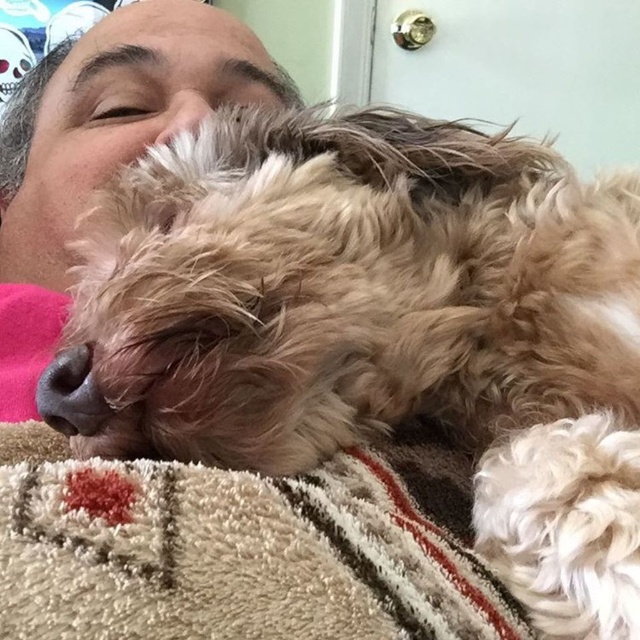
Question: Does white soft blanket at lower center have a larger size compared to matte pink fabric at left?

Choices:
 (A) yes
 (B) no

Answer: (B)

Question: Which of the following is the farthest from the observer?

Choices:
 (A) white soft blanket at lower center
 (B) matte pink fabric at left

Answer: (B)

Question: Can you confirm if white soft blanket at lower center is thinner than matte pink fabric at left?

Choices:
 (A) no
 (B) yes

Answer: (B)

Question: Observing the image, what is the correct spatial positioning of white soft blanket at lower center in reference to matte pink fabric at left?

Choices:
 (A) right
 (B) left

Answer: (A)

Question: Which object is farther from the camera taking this photo?

Choices:
 (A) matte pink fabric at left
 (B) white soft blanket at lower center

Answer: (A)